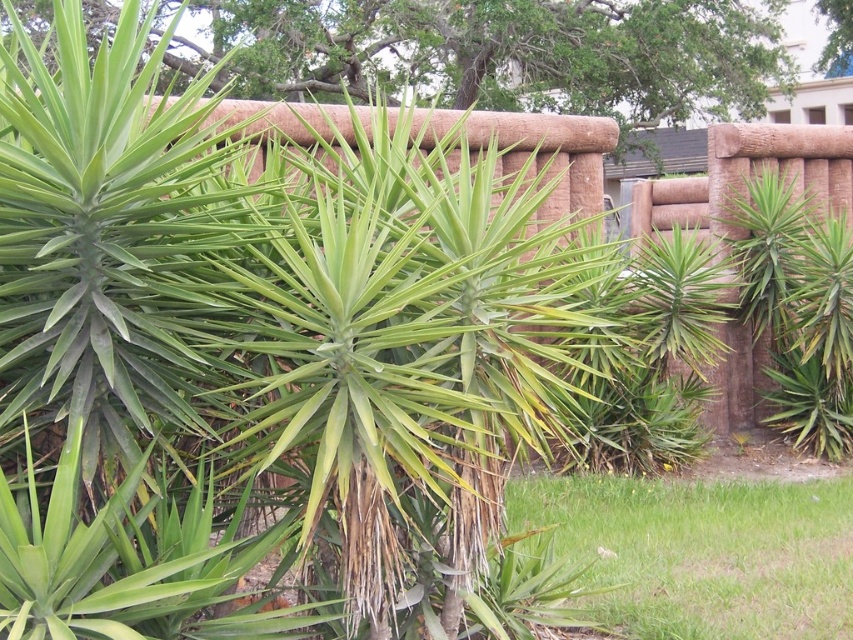
Locate an element on the screen. The image size is (853, 640). green leafy plant at center is located at coordinates (508, 54).

Who is taller, green leafy plant at center or green grass at lower right?

With more height is green leafy plant at center.

Find the location of `green leafy plant at center`. green leafy plant at center is located at coordinates (508, 54).